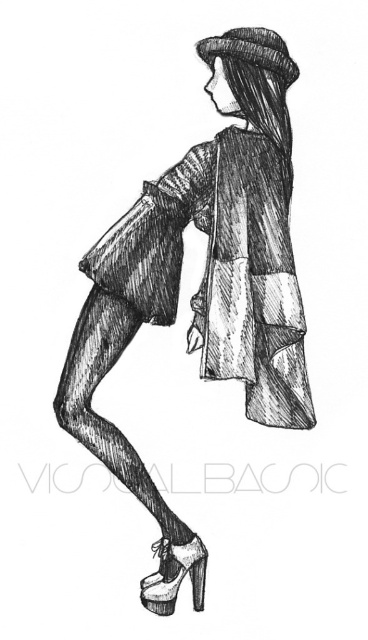
Who is positioned more to the right, matte black coat at center or patchwork fabric dress at center?

matte black coat at center

Does matte black coat at center have a greater width compared to patchwork fabric dress at center?

Yes, matte black coat at center is wider than patchwork fabric dress at center.

The height and width of the screenshot is (640, 368). In order to click on matte black coat at center in this screenshot , I will do `click(200, 282)`.

Does matte black coat at center have a greater height compared to dark brown textured hat at upper center?

Yes, matte black coat at center is taller than dark brown textured hat at upper center.

Can you confirm if matte black coat at center is wider than dark brown textured hat at upper center?

Yes, matte black coat at center is wider than dark brown textured hat at upper center.

Does point (260, 129) come behind point (204, 40)?

Yes, point (260, 129) is behind point (204, 40).

What are the coordinates of `matte black coat at center` in the screenshot? It's located at (200, 282).

Does patchwork fabric dress at center appear on the left side of white leather high-heeled shoe at lower center?

In fact, patchwork fabric dress at center is to the right of white leather high-heeled shoe at lower center.

Is point (163, 276) closer to camera compared to point (157, 554)?

No, (163, 276) is further to viewer.

Consider the image. Who is more forward, (301,301) or (199,593)?

Point (199,593) is more forward.

Find the location of `patchwork fabric dress at center`. patchwork fabric dress at center is located at coordinates (221, 268).